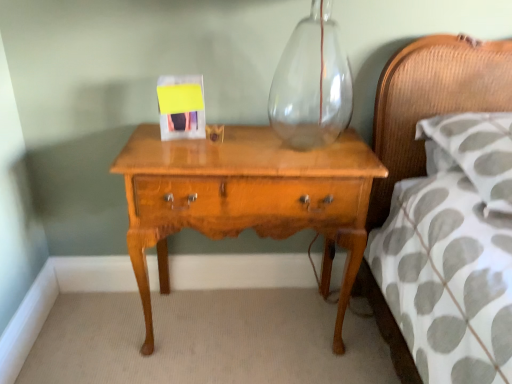
Question: From a real-world perspective, is light brown wood nightstand at center physically located above or below white textured pillow at right?

Choices:
 (A) below
 (B) above

Answer: (A)

Question: From the image's perspective, relative to white textured pillow at right, is light brown wood nightstand at center above or below?

Choices:
 (A) below
 (B) above

Answer: (A)

Question: Is light brown wood nightstand at center inside the boundaries of white textured pillow at right, or outside?

Choices:
 (A) outside
 (B) inside

Answer: (A)

Question: Is white textured pillow at right spatially inside light brown wood nightstand at center, or outside of it?

Choices:
 (A) inside
 (B) outside

Answer: (B)

Question: From a real-world perspective, relative to light brown wood nightstand at center, is white textured pillow at right vertically above or below?

Choices:
 (A) above
 (B) below

Answer: (A)

Question: In the image, is white textured pillow at right positioned in front of or behind light brown wood nightstand at center?

Choices:
 (A) front
 (B) behind

Answer: (A)

Question: Is white textured pillow at right wider or thinner than light brown wood nightstand at center?

Choices:
 (A) thin
 (B) wide

Answer: (B)